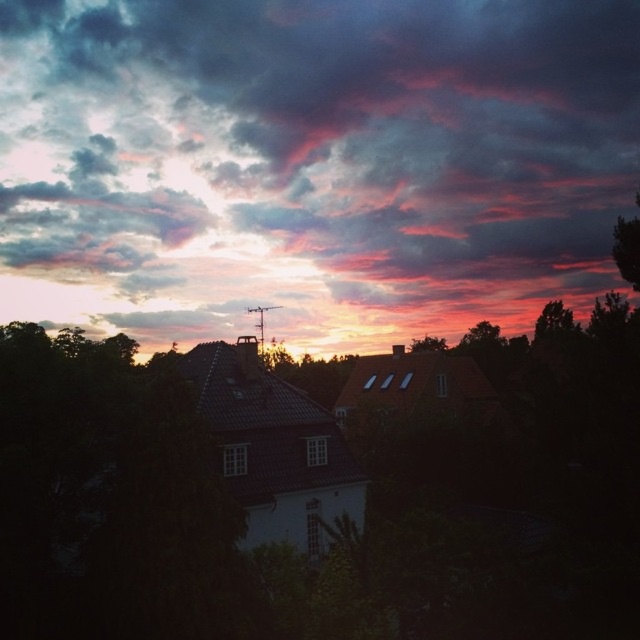
You are an astronomer analyzing the sunset scene. You notice the cloudy sky at upper center. Based on its position, can you determine if it is closer to the horizon or the top edge of the sky?

The cloudy sky at upper center is located at point coordinates that place it closer to the horizon than the top edge of the sky. Since its y coordinate is 0.489, which is less than 0.5, it is closer to the horizon.

You are an architect designing a new residential area. You want to ensure that the new houses will not block the view of the cloudy sky at upper center from the front yard. Given that the dark green leafy tree at upper right is already present, which object would you need to consider its width to determine if it obstructs the view?

The cloudy sky at upper center has a greater width than the dark green leafy tree at upper right, so the tree may not fully block the view of the sky since the sky is wider. However, the architect should still consider the tree and its placement to ensure the desired view remains unobstructed.

You are an artist trying to paint the sunset scene. You need to decide which object should be painted first based on their size. Which one should you start with, the cloudy sky at upper center or the green leafy tree at right?

The cloudy sky at upper center is larger in size than the green leafy tree at right, so you should start painting the cloudy sky at upper center first because it covers more area and requires more attention to detail.